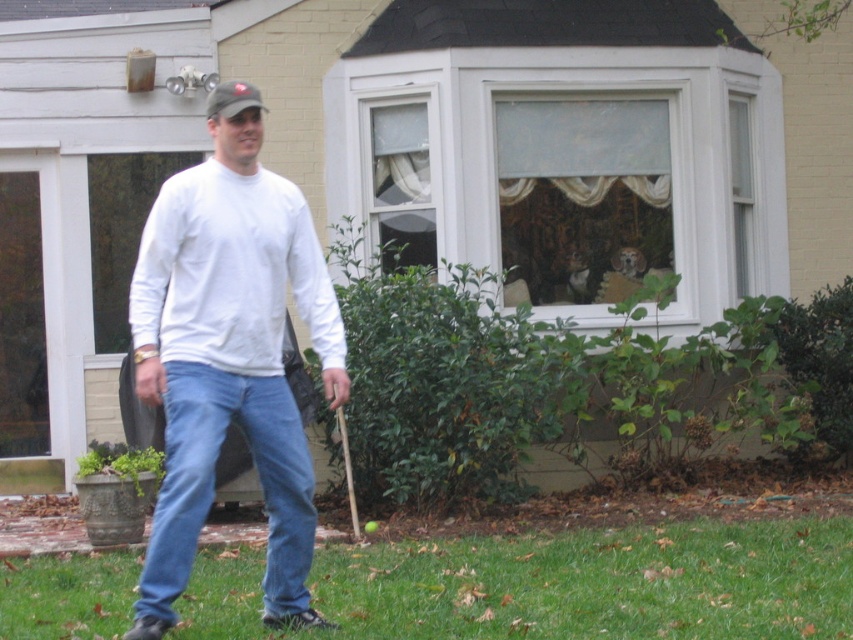
You are a fashion designer observing the person in the image. You need to determine which clothing item requires more fabric for a custom order. Which item would need more fabric between the white cotton shirt at center and the blue denim jeans at lower center?

The white cotton shirt at center requires more fabric since it is bigger than the blue denim jeans at lower center.

Consider the image. You are a drone operator trying to capture a photo of the blue denim jeans at lower center without the green grass at lower center appearing in the frame. Given that your camera has a maximum focus range of 3 feet, can you adjust your position to achieve this?

The green grass at lower center and blue denim jeans at lower center are 3.75 feet apart. Since the camera has a maximum focus range of 3 feet, the drone cannot capture the blue denim jeans at lower center without the green grass at lower center appearing in the frame because the distance between them exceeds the camera range.

Consider the image. You are standing in the residential house backyard and want to place a small garden decoration. The decoration requires a space wider than the blue denim jeans at lower center. Can the green grass at lower center accommodate this requirement?

The green grass at lower center has a width that surpasses the blue denim jeans at lower center, so yes, the green grass at lower center can accommodate the garden decoration requiring a space wider than the blue denim jeans at lower center.